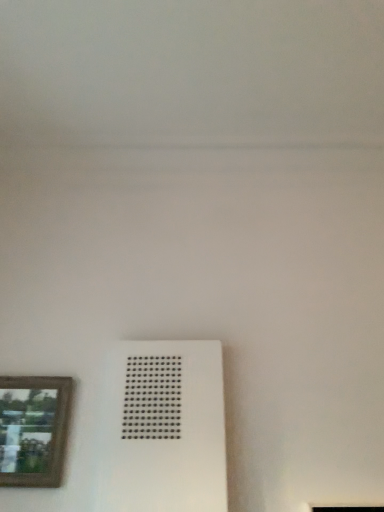
What is the approximate width of wooden framed picture at lower left?

1.68 inches.

I want to click on wooden framed picture at lower left, so click(34, 431).

What do you see at coordinates (34, 431) in the screenshot? The height and width of the screenshot is (512, 384). I see `wooden framed picture at lower left` at bounding box center [34, 431].

Where is `wooden framed picture at lower left`? This screenshot has height=512, width=384. wooden framed picture at lower left is located at coordinates [34, 431].